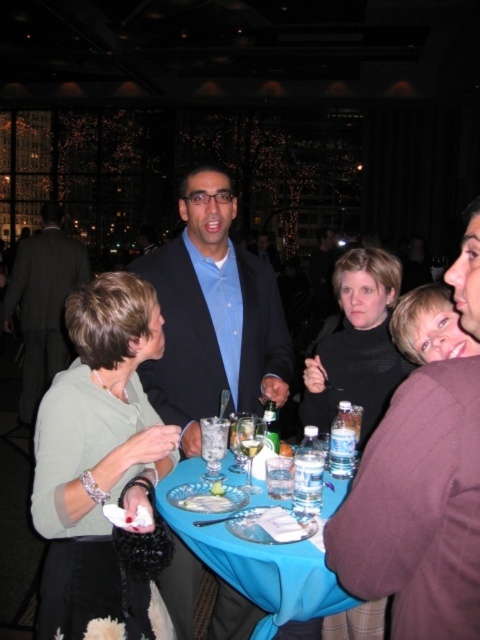
Question: Is black knit sweater at center thinner than clear glass at table center?

Choices:
 (A) no
 (B) yes

Answer: (A)

Question: Which object appears closest to the camera in this image?

Choices:
 (A) white porcelain plate at table center
 (B) white porcelain bowl at table center
 (C) black knit sweater at center
 (D) translucent plastic water at table center

Answer: (D)

Question: Can you confirm if blue shirt at center is thinner than green leafy salad at table center?

Choices:
 (A) no
 (B) yes

Answer: (A)

Question: Can you confirm if clear plastic cup at table center is positioned to the left of white porcelain plate at table center?

Choices:
 (A) no
 (B) yes

Answer: (A)

Question: Which of the following is the closest to the observer?

Choices:
 (A) blue fabric table at center
 (B) blue shirt at center
 (C) clear plastic cup at table center
 (D) green leafy salad at table center

Answer: (A)

Question: Which point appears farthest from the camera in this image?

Choices:
 (A) (210, 488)
 (B) (182, 193)

Answer: (B)